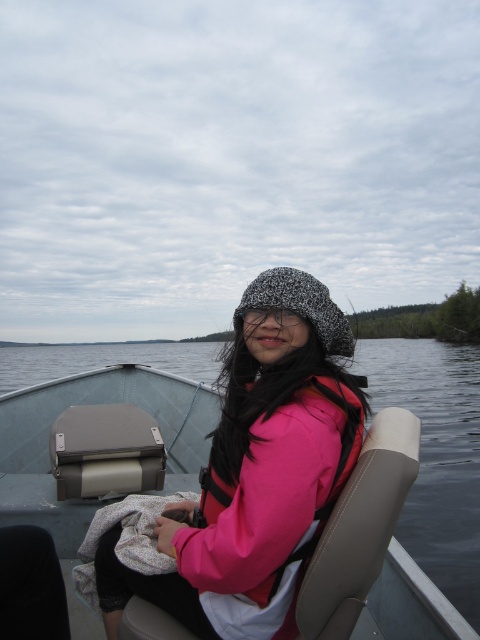
You are standing on the dock and want to retrieve the pink fabric life jacket at center from the boat. The boat is 4.06 feet away from you. Can you reach it without getting into the water?

The pink fabric life jacket at center is 4.06 feet away from the viewer. If you can reach that distance, you can retrieve it without entering the water, but if your reach is shorter, you might need to step into the water or use a tool.

You are a lifeguard on duty and notice a swimmer in the water. You have to decide which item from the image to use for rescue. The pink fleece jacket at center and the pink fabric life jacket at center are both available. Which one should you choose and why?

You should choose the pink fabric life jacket at center because it is designed for water rescue purposes, whereas the pink fleece jacket at center is larger in size but not intended for buoyancy support.

You are a photographer trying to capture a closeup of the pink fleece jacket at center and the speckled knit hat at center. Which object should you zoom in on to ensure both are in frame without moving the camera?

The pink fleece jacket at center is wider than the speckled knit hat at center, so you should zoom in on the pink fleece jacket at center to ensure both are in frame without moving the camera.